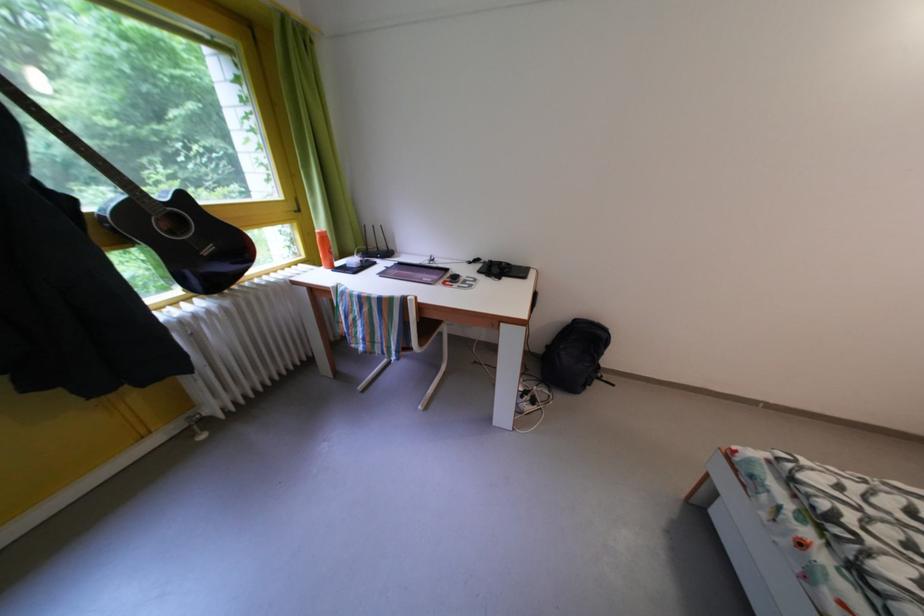
Where would you sit the chair sitting surface? Please return your answer as a coordinate pair (x, y).

(419, 331)